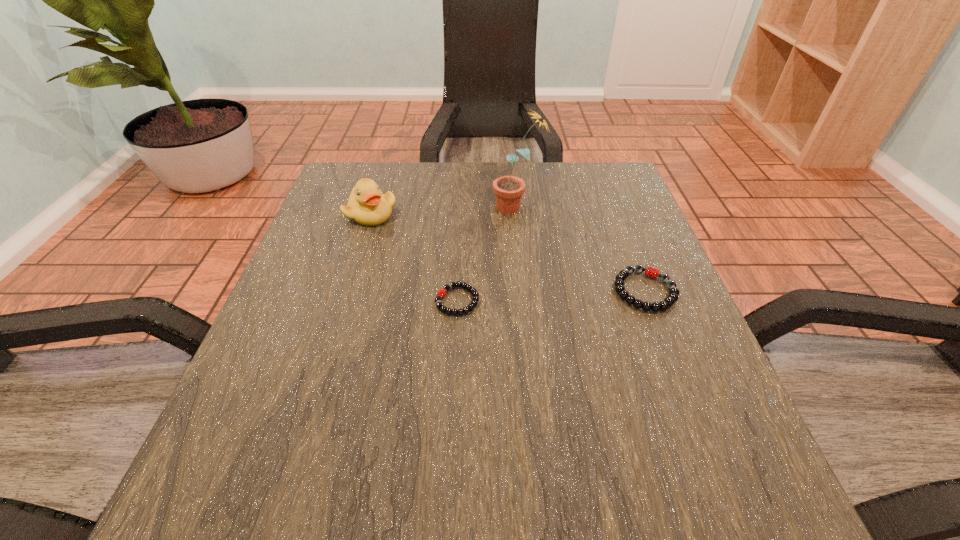
Image resolution: width=960 pixels, height=540 pixels. In order to click on free space located 0.170m on the flower of the third object from left to right in this screenshot , I will do `click(420, 207)`.

The image size is (960, 540). What are the coordinates of `free space located on the beak of the duckling` in the screenshot? It's located at (333, 333).

At what (x,y) coordinates should I click in order to perform the action: click on vacant space positioned 0.240m on the left of the rightmost object. Please return your answer as a coordinate pair (x, y). Looking at the image, I should click on (487, 291).

Locate an element on the screen. The image size is (960, 540). blank space located on the back of the left bracelet is located at coordinates (461, 231).

In order to click on sunflower that is at the far edge in this screenshot , I will do `click(508, 189)`.

Identify the location of duckling that is at the far edge. Image resolution: width=960 pixels, height=540 pixels. (367, 206).

This screenshot has height=540, width=960. I want to click on object that is at the left edge, so click(367, 206).

Image resolution: width=960 pixels, height=540 pixels. Identify the location of object that is at the right edge. (651, 272).

You are a GUI agent. You are given a task and a screenshot of the screen. Output one action in this format:
    pyautogui.click(x=<x>, y=<y>)
    Task: Click on the object located in the far left corner section of the desktop
    
    Given the screenshot: What is the action you would take?
    pyautogui.click(x=367, y=206)

Image resolution: width=960 pixels, height=540 pixels. In the image, there is a desktop. What are the coordinates of `vacant space at the far edge` in the screenshot? It's located at (558, 183).